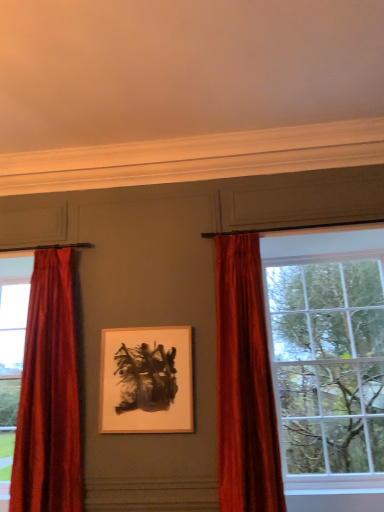
Question: Is matte glass window at right far from matte white picture frame at center?

Choices:
 (A) no
 (B) yes

Answer: (B)

Question: From the image's perspective, is matte glass window at right below matte white picture frame at center?

Choices:
 (A) no
 (B) yes

Answer: (B)

Question: Is matte glass window at right next to matte white picture frame at center and touching it?

Choices:
 (A) no
 (B) yes

Answer: (A)

Question: From a real-world perspective, is matte glass window at right on matte white picture frame at center?

Choices:
 (A) no
 (B) yes

Answer: (A)

Question: Can you confirm if matte glass window at right is taller than matte white picture frame at center?

Choices:
 (A) no
 (B) yes

Answer: (B)

Question: Is velvet red curtain at right, placed as the 2th curtain when sorted from left to right, inside or outside of matte white picture frame at center?

Choices:
 (A) outside
 (B) inside

Answer: (A)

Question: From a real-world perspective, is velvet red curtain at right, placed as the 2th curtain when sorted from left to right, positioned above or below matte white picture frame at center?

Choices:
 (A) below
 (B) above

Answer: (B)

Question: From the image's perspective, is velvet red curtain at right, which is the first curtain in right-to-left order, above or below matte white picture frame at center?

Choices:
 (A) below
 (B) above

Answer: (B)

Question: In the image, is velvet red curtain at right, which is the first curtain in right-to-left order, on the left side or the right side of matte white picture frame at center?

Choices:
 (A) right
 (B) left

Answer: (A)

Question: From a real-world perspective, relative to velvet red curtain at left, which is the 1th curtain from left to right, is matte white picture frame at center vertically above or below?

Choices:
 (A) below
 (B) above

Answer: (A)

Question: Would you say matte white picture frame at center is inside or outside velvet red curtain at left, arranged as the second curtain when viewed from the right?

Choices:
 (A) outside
 (B) inside

Answer: (A)

Question: Considering the positions of matte white picture frame at center and velvet red curtain at left, which is the 1th curtain from left to right, in the image, is matte white picture frame at center taller or shorter than velvet red curtain at left, which is the 1th curtain from left to right,?

Choices:
 (A) tall
 (B) short

Answer: (B)

Question: In terms of size, does matte white picture frame at center appear bigger or smaller than velvet red curtain at left, arranged as the second curtain when viewed from the right?

Choices:
 (A) small
 (B) big

Answer: (A)

Question: From a real-world perspective, is matte glass window at right physically located above or below velvet red curtain at right, placed as the 2th curtain when sorted from left to right?

Choices:
 (A) below
 (B) above

Answer: (A)

Question: Considering the positions of matte glass window at right and velvet red curtain at right, which is the first curtain in right-to-left order, in the image, is matte glass window at right wider or thinner than velvet red curtain at right, which is the first curtain in right-to-left order,?

Choices:
 (A) wide
 (B) thin

Answer: (A)